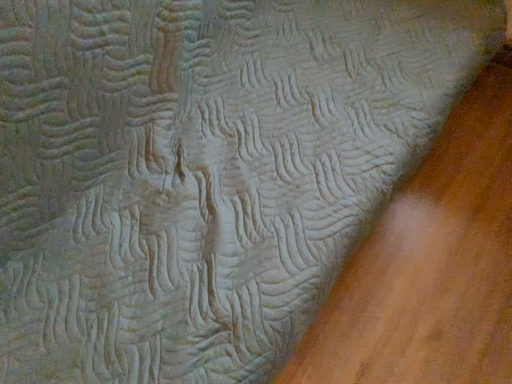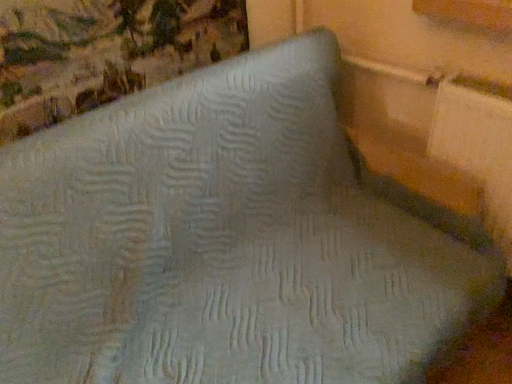
Question: Which way did the camera rotate in the video?

Choices:
 (A) rotated upward
 (B) rotated downward

Answer: (A)